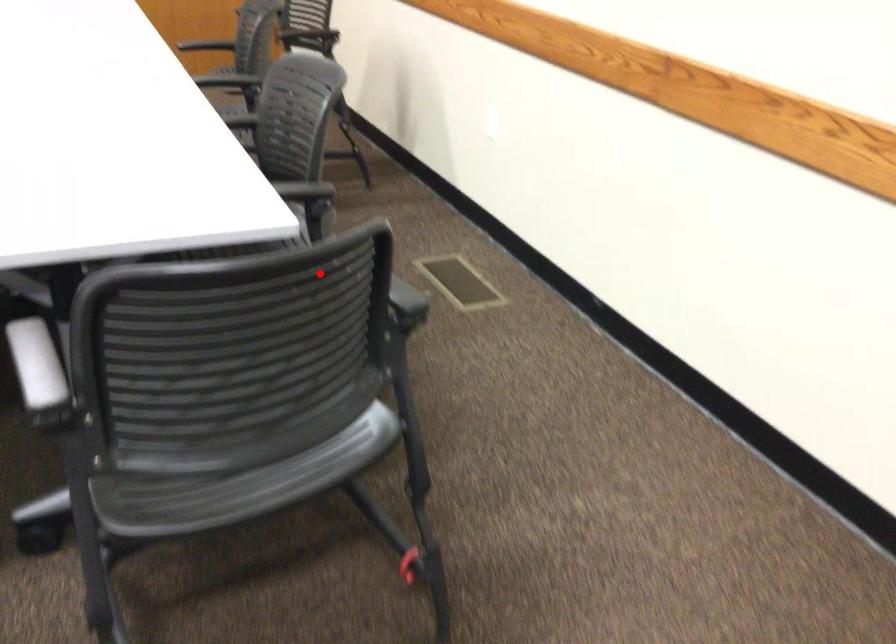
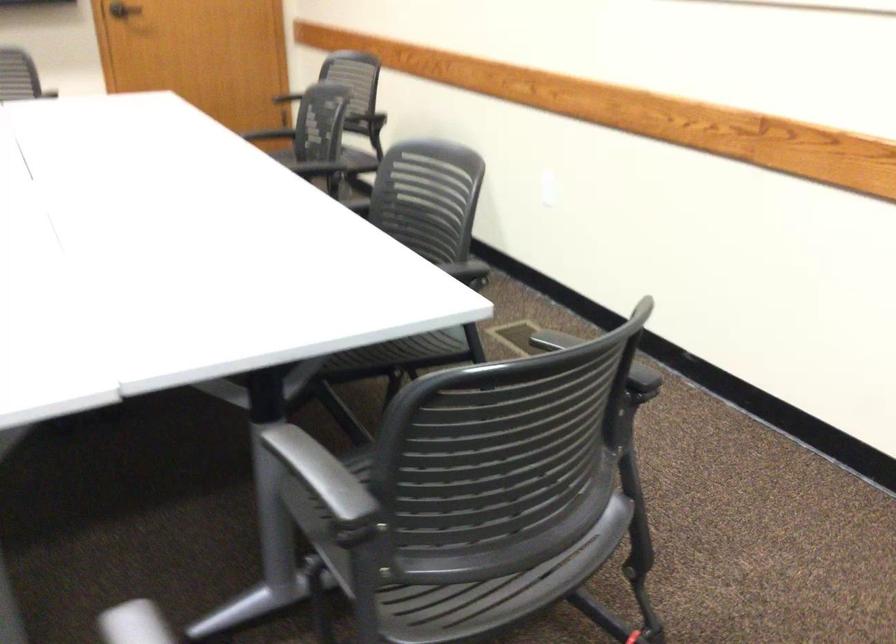
In the second image, find the point that corresponds to the highlighted location in the first image.

(598, 359)